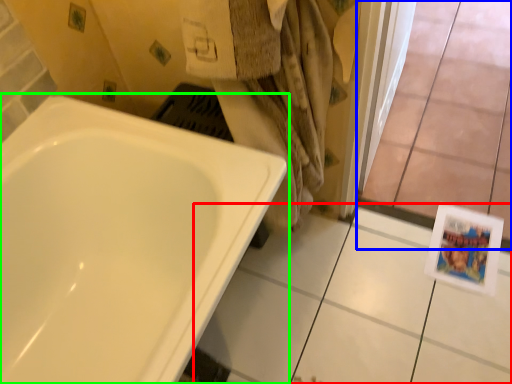
Question: Which is nearer to the ceramic tile (highlighted by a red box)? glass door (highlighted by a blue box) or bathtub (highlighted by a green box).

Choices:
 (A) glass door
 (B) bathtub

Answer: (A)